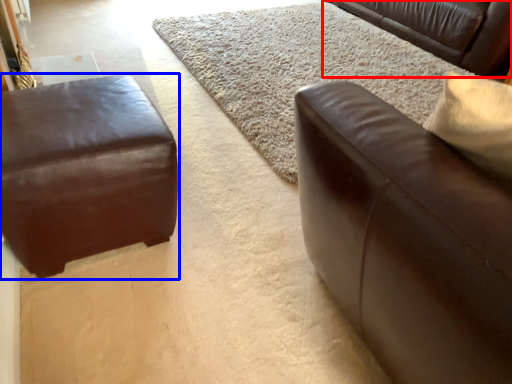
Question: Which of the following is the closest to the observer, studio couch (highlighted by a red box) or studio couch (highlighted by a blue box)?

Choices:
 (A) studio couch
 (B) studio couch

Answer: (B)